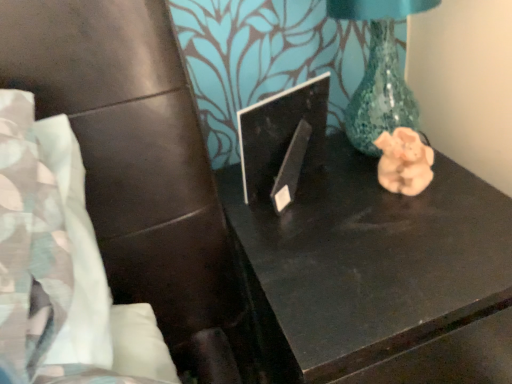
Find the location of a particular element. The width and height of the screenshot is (512, 384). free space above black glossy table at center (from a real-world perspective) is located at coordinates (367, 226).